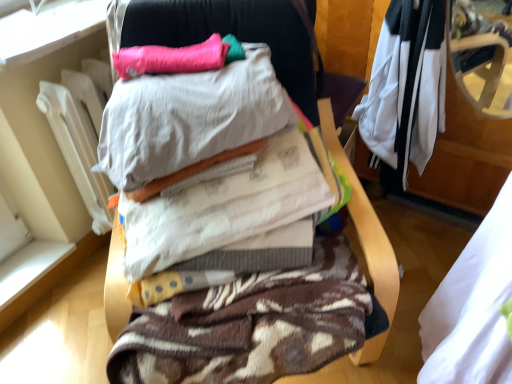
Question: Can brown textured blanket at center be found inside white cotton sheets at center, the 3th clothing when ordered from back to front?

Choices:
 (A) no
 (B) yes

Answer: (A)

Question: Could you tell me if white cotton sheets at center, the 3th clothing when ordered from back to front, is turned towards brown textured blanket at center?

Choices:
 (A) no
 (B) yes

Answer: (B)

Question: Is white cotton sheets at center, the 3th clothing when ordered from back to front, further to camera compared to brown textured blanket at center?

Choices:
 (A) yes
 (B) no

Answer: (A)

Question: From a real-world perspective, is white cotton sheets at center, which is the second clothing in front-to-back order, physically above brown textured blanket at center?

Choices:
 (A) yes
 (B) no

Answer: (A)

Question: Is white cotton sheets at center, the 3th clothing when ordered from back to front, in front of brown textured blanket at center?

Choices:
 (A) yes
 (B) no

Answer: (B)

Question: Are white cotton sheets at center, which is the second clothing in front-to-back order, and brown textured blanket at center making contact?

Choices:
 (A) no
 (B) yes

Answer: (A)

Question: Does white/black fabric jacket at upper right, the fourth clothing when ordered from front to back, have a greater height compared to white fabric at right, placed as the 1th clothing when sorted from front to back?

Choices:
 (A) no
 (B) yes

Answer: (A)

Question: Would you consider white/black fabric jacket at upper right, the fourth clothing when ordered from front to back, to be distant from white fabric at right, placed as the 1th clothing when sorted from front to back?

Choices:
 (A) no
 (B) yes

Answer: (A)

Question: Is white/black fabric jacket at upper right, the 1th clothing when ordered from back to front, facing towards white fabric at right, placed as the 1th clothing when sorted from front to back?

Choices:
 (A) yes
 (B) no

Answer: (B)

Question: Is white fabric at right, the fourth clothing from the back, at the back of white/black fabric jacket at upper right, the fourth clothing when ordered from front to back?

Choices:
 (A) no
 (B) yes

Answer: (A)

Question: From the image's perspective, is white/black fabric jacket at upper right, the fourth clothing when ordered from front to back, beneath white fabric at right, the fourth clothing from the back?

Choices:
 (A) no
 (B) yes

Answer: (A)

Question: Is white/black fabric jacket at upper right, the 1th clothing when ordered from back to front, to the left of white fabric at right, placed as the 1th clothing when sorted from front to back, from the viewer's perspective?

Choices:
 (A) yes
 (B) no

Answer: (B)

Question: From the image's perspective, does white/black fabric jacket at upper right, the fourth clothing when ordered from front to back, appear lower than pink fluffy pillow at upper center, positioned as the second pillow in front-to-back order?

Choices:
 (A) yes
 (B) no

Answer: (A)